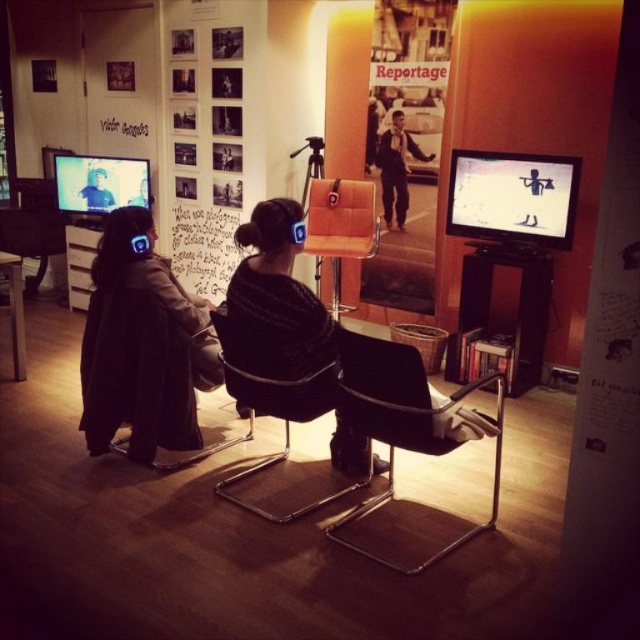
You are a technician checking the setup for a presentation. You need to ensure that the white matte screen at right and the matte black headphones at left are positioned correctly. According to the description, which object is taller?

The white matte screen at right is much taller than the matte black headphones at left.